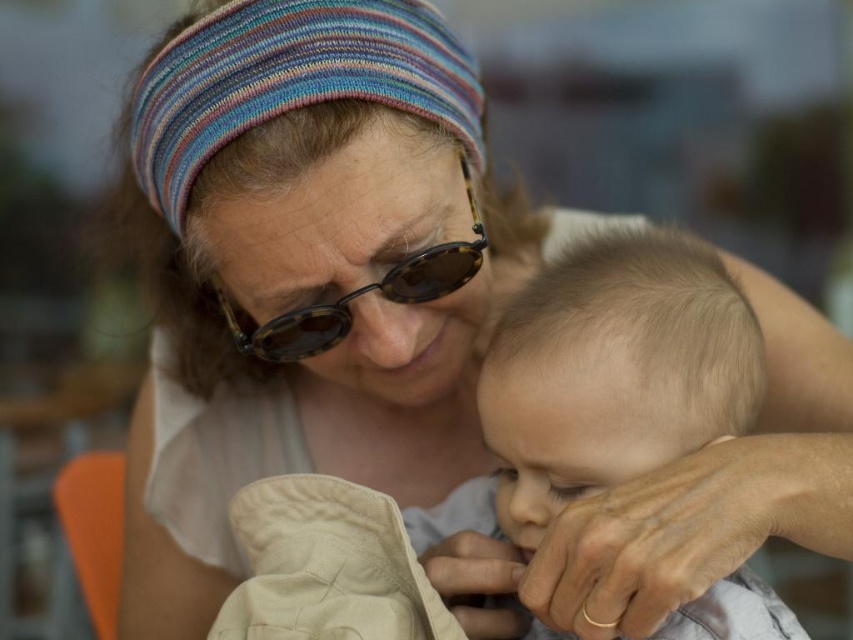
Question: Does smooth beige shirt at center have a larger size compared to tortoiseshell sunglasses at center?

Choices:
 (A) no
 (B) yes

Answer: (B)

Question: Which object appears closest to the camera in this image?

Choices:
 (A) smooth beige shirt at center
 (B) tortoiseshell sunglasses at center

Answer: (A)

Question: Which object is closer to the camera taking this photo?

Choices:
 (A) smooth beige shirt at center
 (B) tortoiseshell sunglasses at center

Answer: (A)

Question: Can you confirm if smooth beige shirt at center is positioned to the left of tortoiseshell sunglasses at center?

Choices:
 (A) no
 (B) yes

Answer: (A)

Question: Among these points, which one is nearest to the camera?

Choices:
 (A) (666, 436)
 (B) (300, 308)

Answer: (A)

Question: Does smooth beige shirt at center lie behind tortoiseshell sunglasses at center?

Choices:
 (A) no
 (B) yes

Answer: (A)